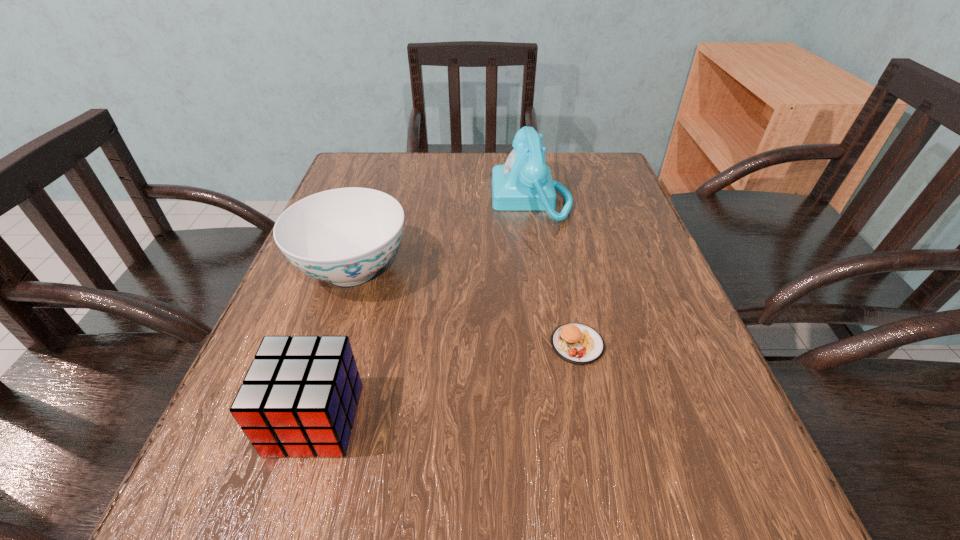
Find the location of a particular element. This screenshot has width=960, height=540. telephone is located at coordinates (524, 183).

Where is `the farthest object`? the farthest object is located at coordinates (524, 183).

Identify the location of the third nearest object. Image resolution: width=960 pixels, height=540 pixels. (x=344, y=236).

At what (x,y) coordinates should I click in order to perform the action: click on the nearest object. Please return your answer as a coordinate pair (x, y). The width and height of the screenshot is (960, 540). Looking at the image, I should click on (299, 397).

Locate an element on the screen. the shortest object is located at coordinates (576, 343).

Image resolution: width=960 pixels, height=540 pixels. Find the location of `patty`. patty is located at coordinates (576, 343).

Locate an element on the screen. Image resolution: width=960 pixels, height=540 pixels. blank space located on the dial of the farthest object is located at coordinates (435, 198).

Find the location of `vacant space situated on the dial of the farthest object`. vacant space situated on the dial of the farthest object is located at coordinates (422, 198).

The height and width of the screenshot is (540, 960). I want to click on vacant space located 0.220m on the dial of the farthest object, so click(x=402, y=198).

The width and height of the screenshot is (960, 540). I want to click on vacant space located 0.310m on the back of the second farthest object, so click(x=386, y=167).